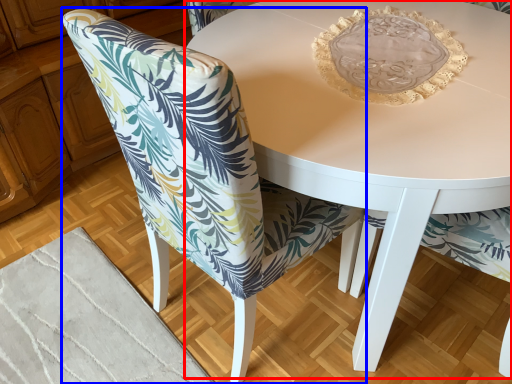
Question: Which point is further to the camera, coffee table (highlighted by a red box) or chair (highlighted by a blue box)?

Choices:
 (A) coffee table
 (B) chair

Answer: (A)